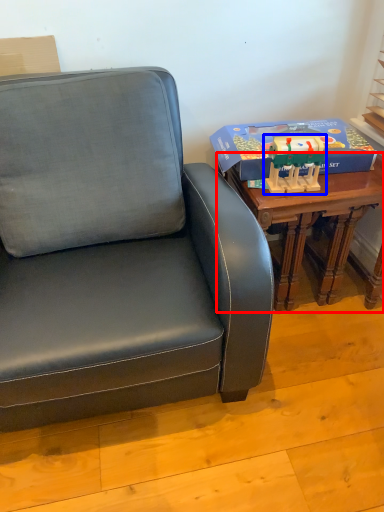
Question: Which object appears closest to the camera in this image, table (highlighted by a red box) or toy (highlighted by a blue box)?

Choices:
 (A) table
 (B) toy

Answer: (B)